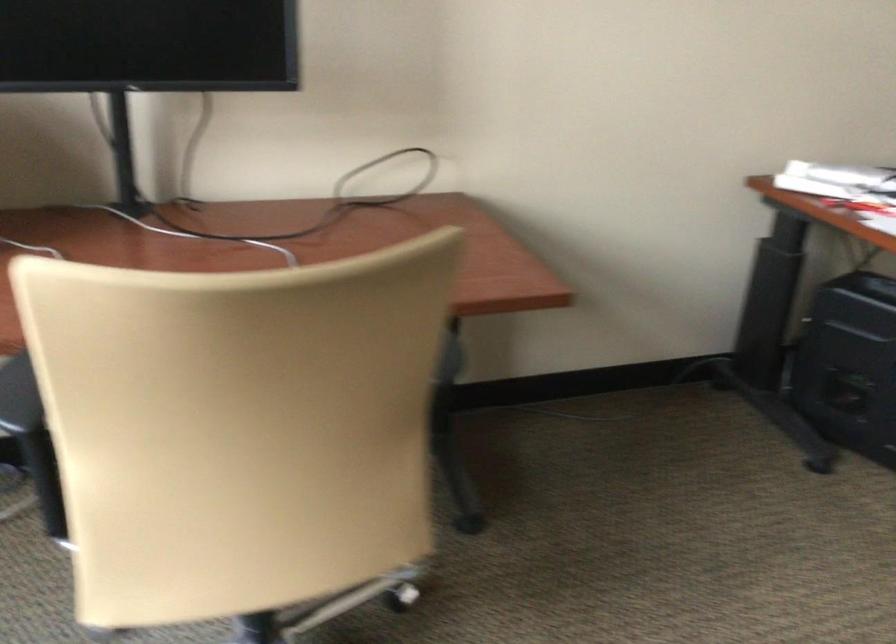
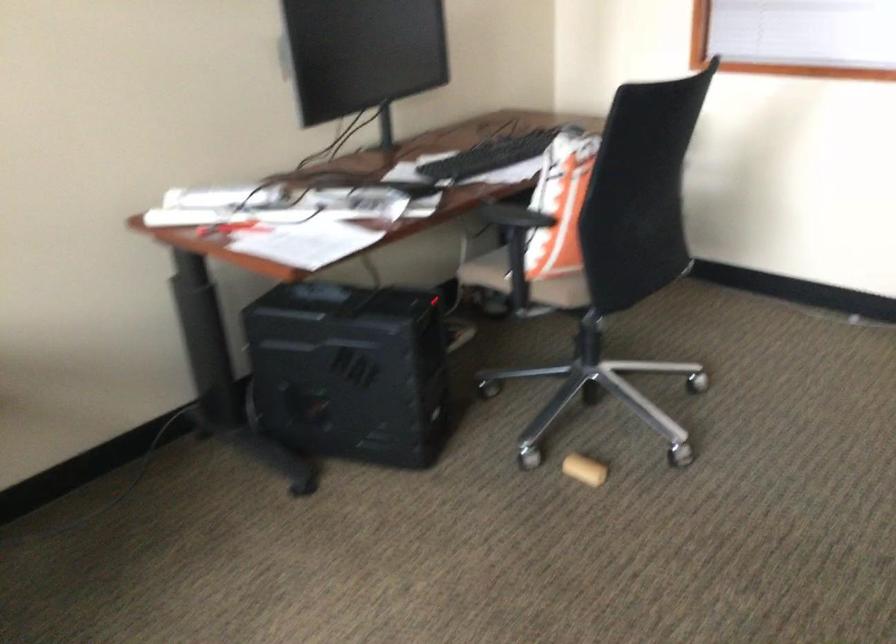
Question: The camera is either moving clockwise (left) or counter-clockwise (right) around the object. The first image is from the beginning of the video and the second image is from the end. Is the camera moving left or right when shooting the video?

Choices:
 (A) Left
 (B) Right

Answer: (A)